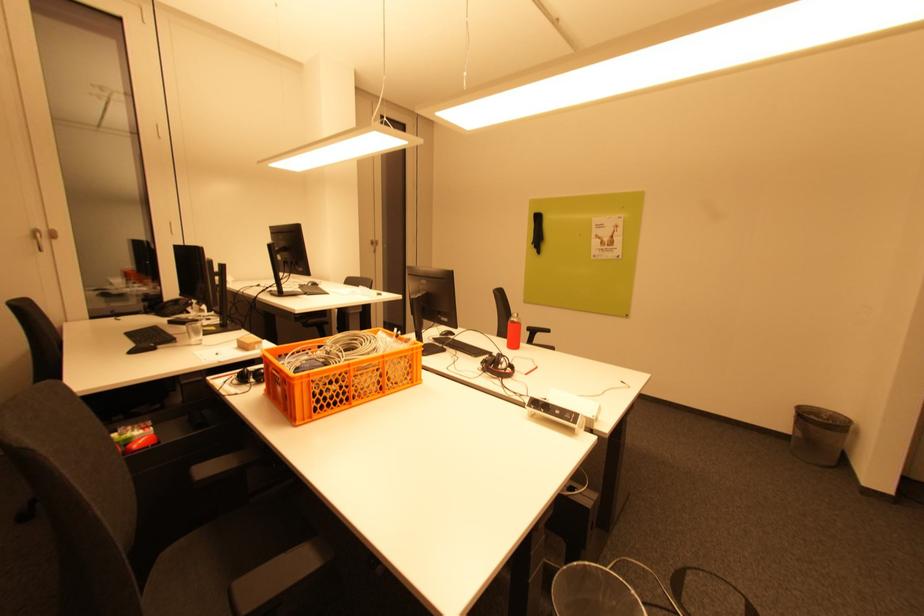
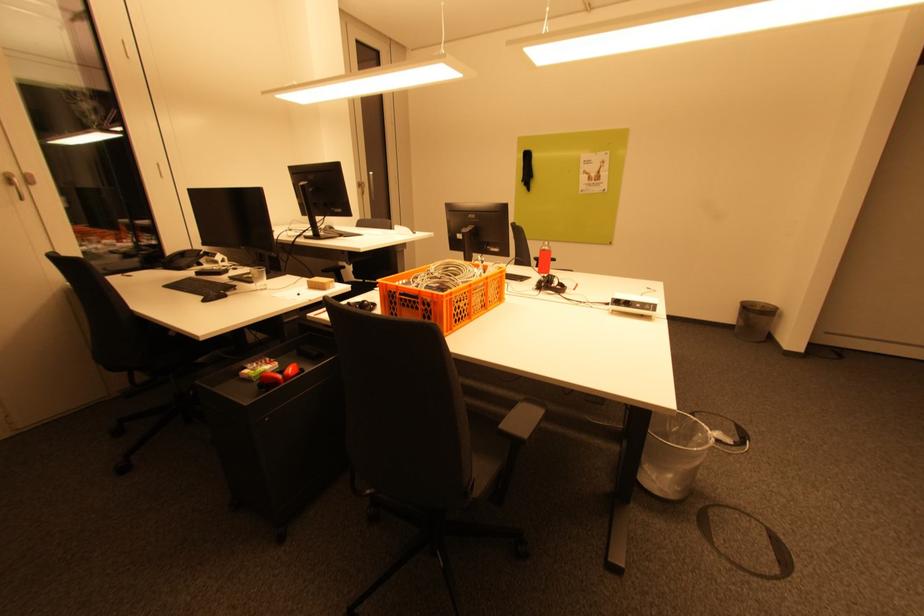
Question: The images are taken continuously from a first-person perspective. In which direction are you moving?

Choices:
 (A) Left
 (B) Right
 (C) Forward
 (D) Backward

Answer: (A)